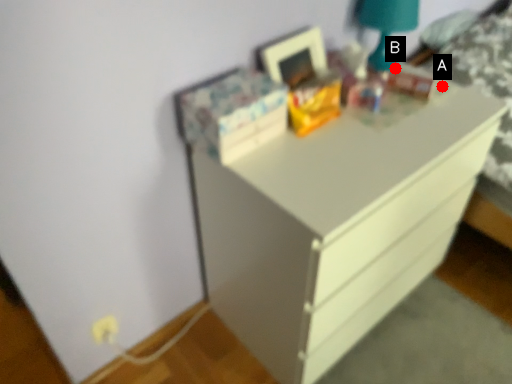
Question: Two points are circled on the image, labeled by A and B beside each circle. Which point is further to the camera?

Choices:
 (A) A is further
 (B) B is further

Answer: (B)